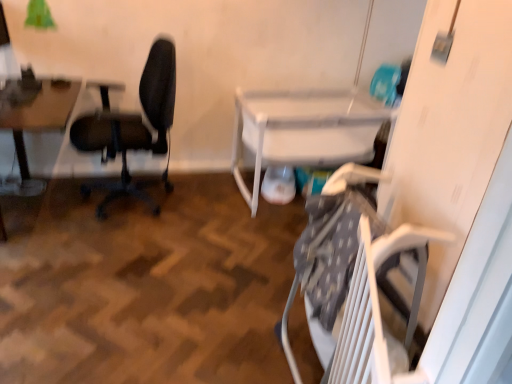
Find the location of a particular element. The width and height of the screenshot is (512, 384). vacant space in front of black matte office chair at left is located at coordinates (106, 255).